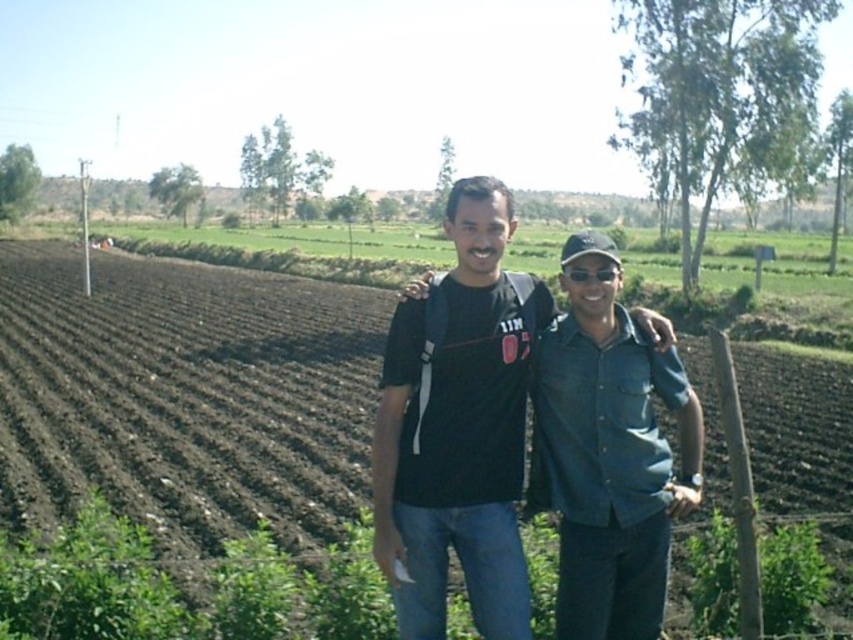
Question: Which of the following is the farthest from the observer?

Choices:
 (A) dark brown soil at center
 (B) black matte shirt at center

Answer: (A)

Question: In this image, where is dark brown soil at center located relative to black matte shirt at center?

Choices:
 (A) left
 (B) right

Answer: (A)

Question: Can you confirm if dark brown soil at center is smaller than black matte shirt at center?

Choices:
 (A) yes
 (B) no

Answer: (B)

Question: Is dark brown soil at center closer to the viewer compared to black matte shirt at center?

Choices:
 (A) yes
 (B) no

Answer: (B)

Question: Which of the following is the farthest from the observer?

Choices:
 (A) black matte shirt at center
 (B) dark brown soil at center

Answer: (B)